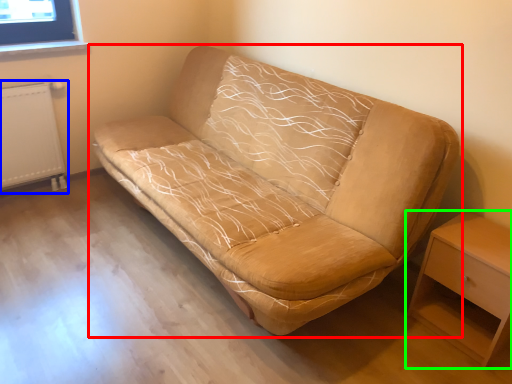
Question: Estimate the real-world distances between objects in this image. Which object is closer to studio couch (highlighted by a red box), radiator (highlighted by a blue box) or nightstand (highlighted by a green box)?

Choices:
 (A) radiator
 (B) nightstand

Answer: (B)